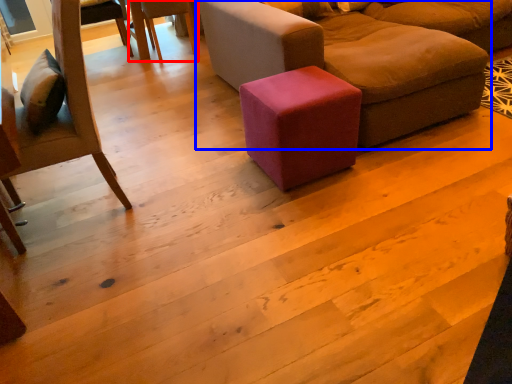
Question: Which of the following is the farthest to the observer, chair (highlighted by a red box) or studio couch (highlighted by a blue box)?

Choices:
 (A) chair
 (B) studio couch

Answer: (A)